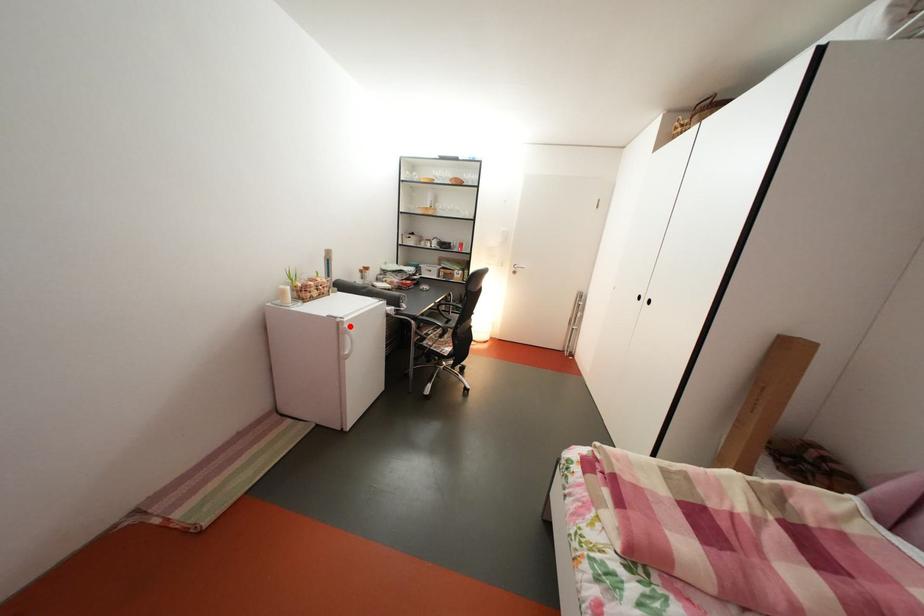
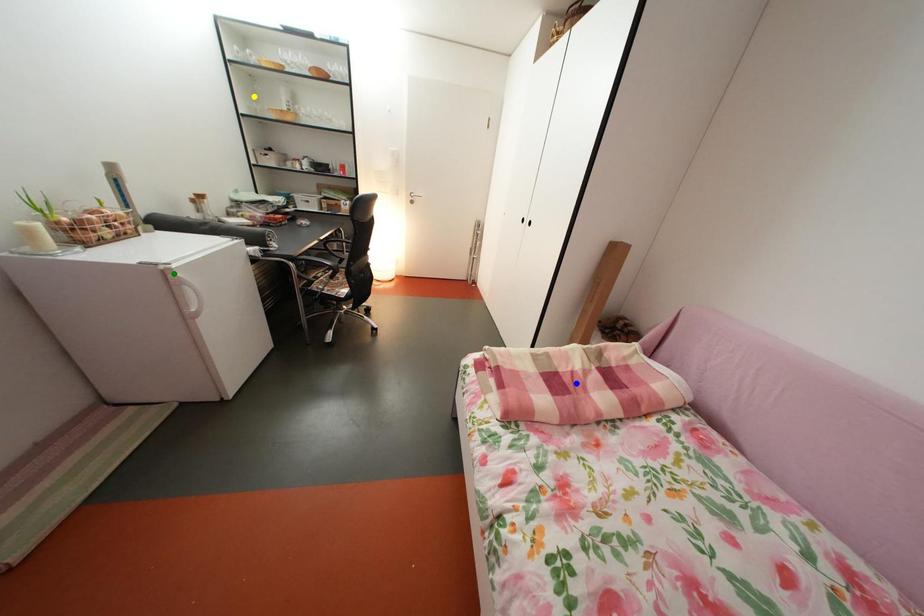
Question: I am providing you with two images of the same scene from different viewpoints. A red point is marked on the first image. You are given multiple points on the second image. Which mark in image 2 goes with the point in image 1?

Choices:
 (A) yellow point
 (B) green point
 (C) blue point

Answer: (B)